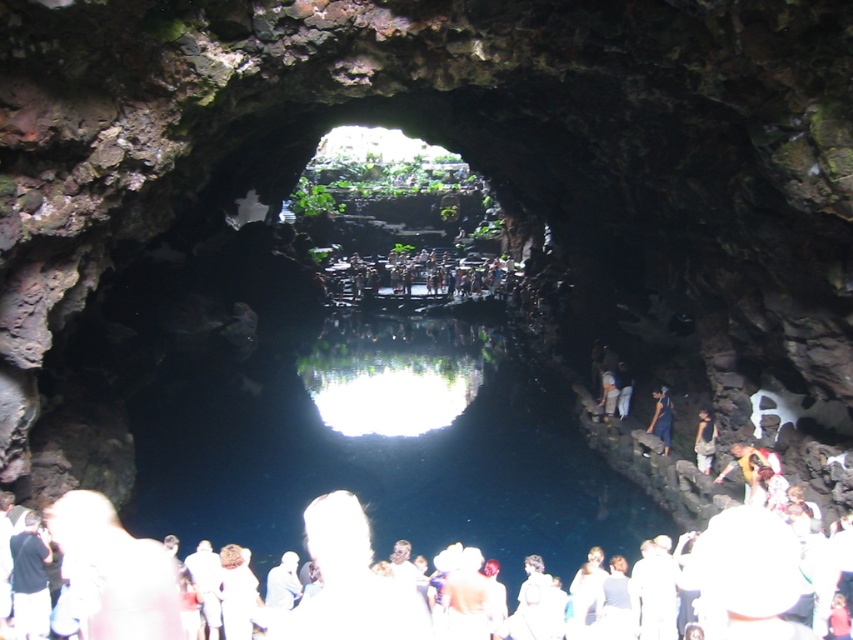
You are standing inside the cave and want to take a photo of both the light brown fabric shirt at center and the dark blue jeans at center. Since the reflective pool of water is at the bottom, which object should you focus on first to ensure both are in the frame?

The light brown fabric shirt at center is positioned on the right side of dark blue jeans at center. To ensure both are in the frame, focus on the light brown fabric shirt at center first as it is on the right, allowing you to adjust the camera angle to include both objects.

You are a hiker who has just entered the cave and is standing at the entrance. You notice a light brown fabric shirt at center and dark blue jeans at center. Which clothing item is closer to you?

The light brown fabric shirt at center is closer to you since it has a smaller size compared to the dark blue jeans at center, indicating it is nearer.